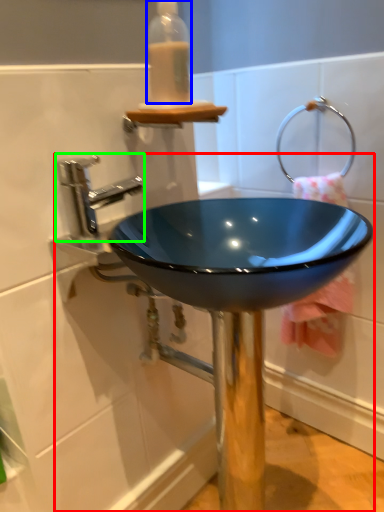
Question: Which object is the farthest from sink (highlighted by a red box)? Choose among these: bottle (highlighted by a blue box) or tap (highlighted by a green box).

Choices:
 (A) bottle
 (B) tap

Answer: (A)